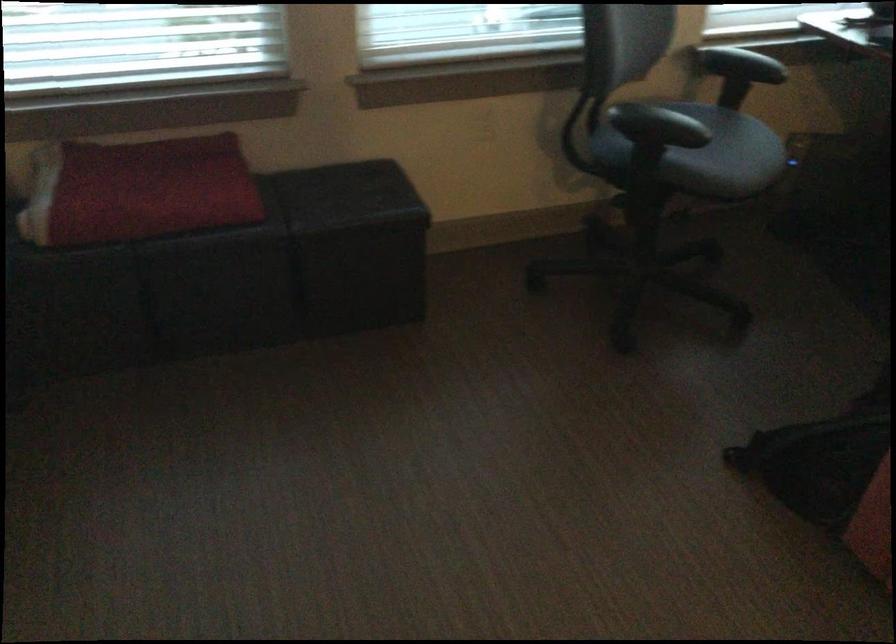
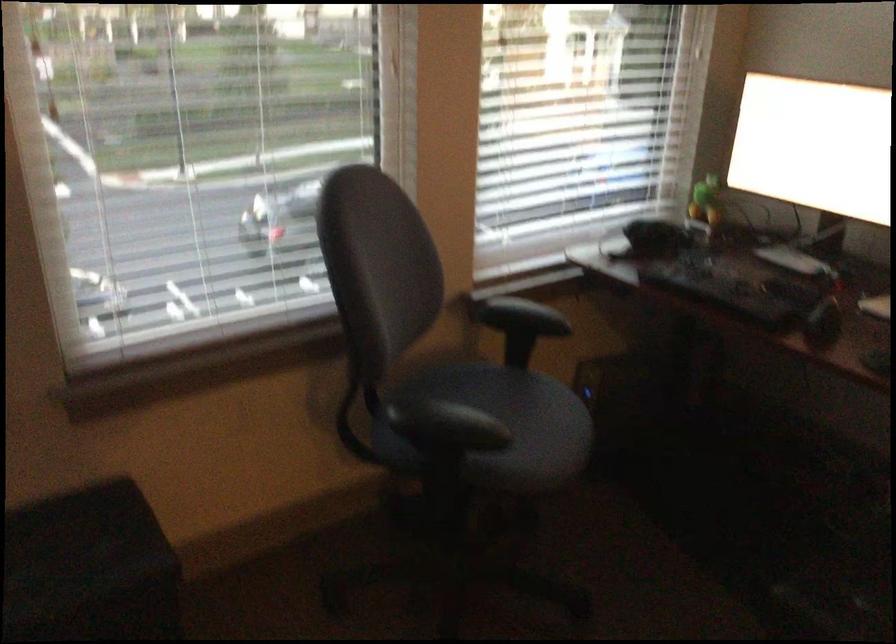
Question: The first image is from the beginning of the video and the second image is from the end. How did the camera likely rotate when shooting the video?

Choices:
 (A) Left
 (B) Right
 (C) Up
 (D) Down

Answer: (B)